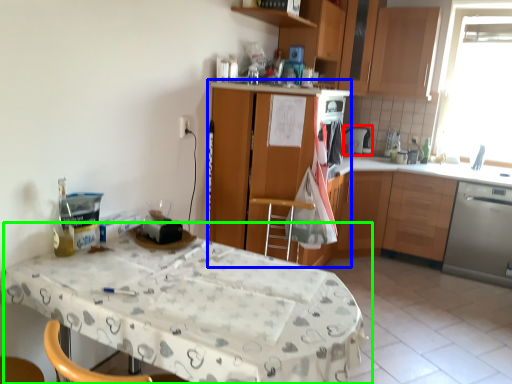
Question: Which object is positioned closest to appliance (highlighted by a red box)? Select from cabinetry (highlighted by a blue box) and table (highlighted by a green box).

Choices:
 (A) cabinetry
 (B) table

Answer: (A)